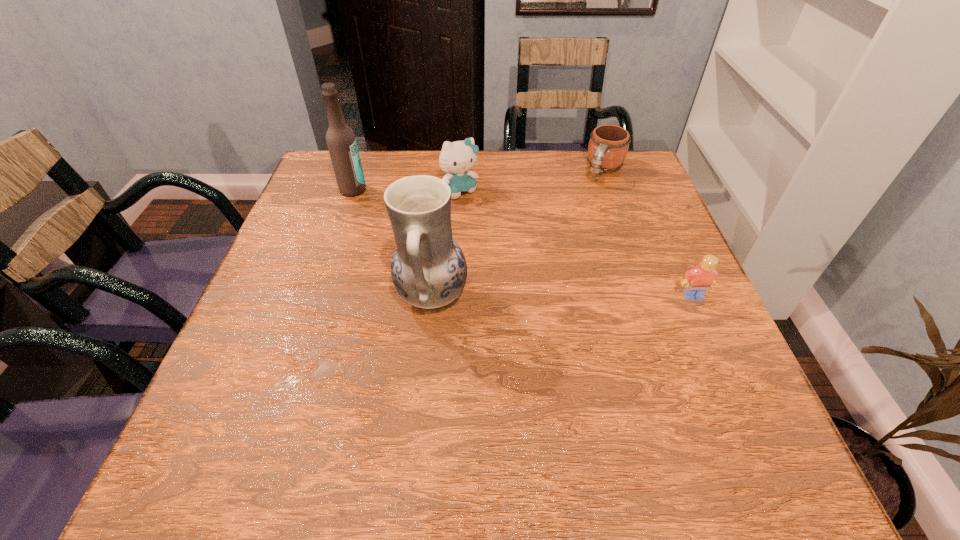
The image size is (960, 540). What are the coordinates of `Lego that is positioned at the right edge` in the screenshot? It's located at (697, 281).

Where is `mug that is at the right edge`? This screenshot has height=540, width=960. mug that is at the right edge is located at coordinates (608, 146).

The image size is (960, 540). What are the coordinates of `object present at the far left corner` in the screenshot? It's located at (341, 141).

Locate an element on the screen. The height and width of the screenshot is (540, 960). object present at the far right corner is located at coordinates (608, 146).

In order to click on blank space at the far edge in this screenshot , I will do `click(507, 188)`.

You are a GUI agent. You are given a task and a screenshot of the screen. Output one action in this format:
    pyautogui.click(x=<x>, y=<y>)
    Task: Click on the blank space at the near edge of the desktop
    The height and width of the screenshot is (540, 960).
    Given the screenshot: What is the action you would take?
    pyautogui.click(x=549, y=379)

Where is `vacant space at the left edge of the desktop`? Image resolution: width=960 pixels, height=540 pixels. vacant space at the left edge of the desktop is located at coordinates (273, 306).

I want to click on vacant area at the right edge of the desktop, so pos(656,233).

Locate an element on the screen. The image size is (960, 540). free space at the near left corner is located at coordinates (215, 413).

In the image, there is a desktop. Find the location of `free space at the far right corner`. free space at the far right corner is located at coordinates (633, 156).